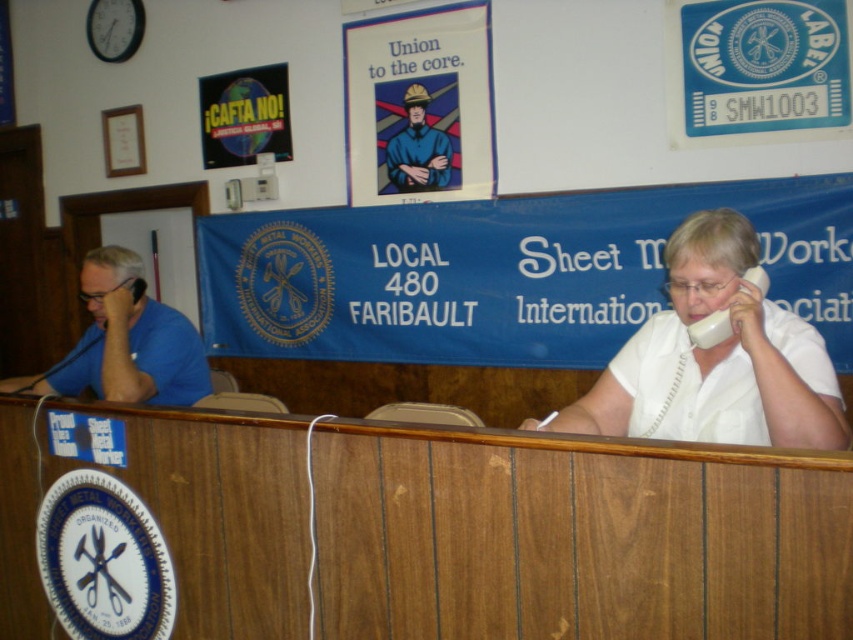
You are an office worker who needs to reach for the white glossy phone at center to take an urgent call. However, there is a matte blue uniform at center in the way. Can you easily access the phone without moving the uniform?

The white glossy phone at center is positioned under the matte blue uniform at center, so it can be accessed without moving the uniform as it is located beneath it.

You are an observer in the union office. You notice two blue items on the desk. The blue shirt at left and the matte blue uniform at center. Which one is taller?

The blue shirt at left is taller than the matte blue uniform at center.

You are an office worker who needs to place a new phone on the desk. The new phone is the same size as the white glossy phone at center. There is a space where the matte blue uniform at center currently occupies. Can the new phone fit in that space?

The white glossy phone at center is bigger than the matte blue uniform at center. Therefore, the new phone, being the same size as the white glossy phone at center, cannot fit into the space occupied by the matte blue uniform at center since it is larger.